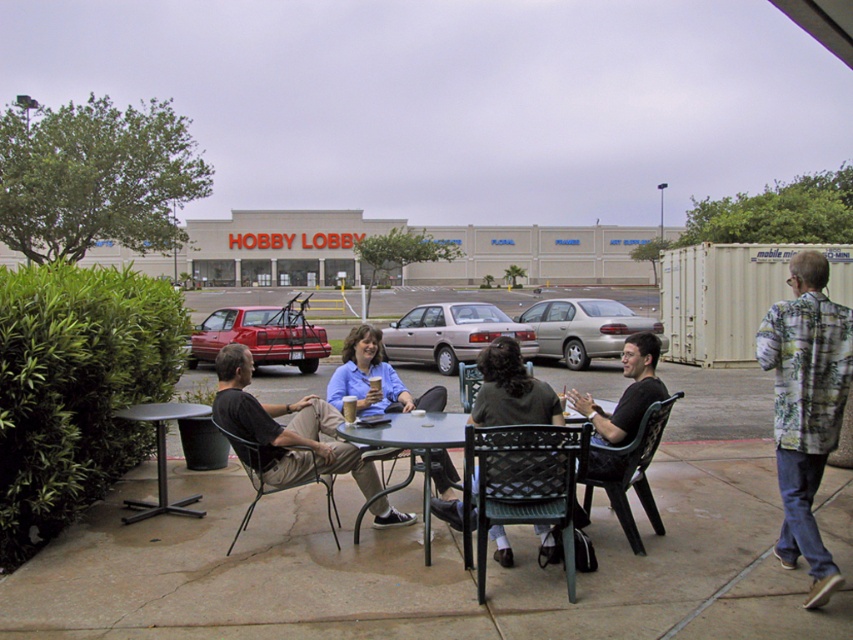
Is shiny red car at center-left taller than metallic black chair at lower left?

Indeed, shiny red car at center-left has a greater height compared to metallic black chair at lower left.

Who is more forward, (297, 358) or (253, 458)?

Point (253, 458) is in front.

Is point (256, 340) positioned before point (264, 445)?

No.

Locate an element on the screen. The image size is (853, 640). shiny red car at center-left is located at coordinates (260, 336).

Which of these two, shiny red car at center-left or gold metallic sedan at center, stands shorter?

With less height is gold metallic sedan at center.

Can you confirm if shiny red car at center-left is wider than gold metallic sedan at center?

No, shiny red car at center-left is not wider than gold metallic sedan at center.

Which is in front, point (309, 372) or point (618, 349)?

Point (618, 349) is more forward.

Where is `shiny red car at center-left`? The height and width of the screenshot is (640, 853). shiny red car at center-left is located at coordinates (260, 336).

In the scene shown: Measure the distance between metallic silver car at center and camera.

metallic silver car at center and camera are 15.31 meters apart.

Who is taller, metallic silver car at center or gold metallic sedan at center?

metallic silver car at center

The width and height of the screenshot is (853, 640). In order to click on metallic silver car at center in this screenshot , I will do `click(439, 300)`.

This screenshot has height=640, width=853. In order to click on metallic silver car at center in this screenshot , I will do [439, 300].